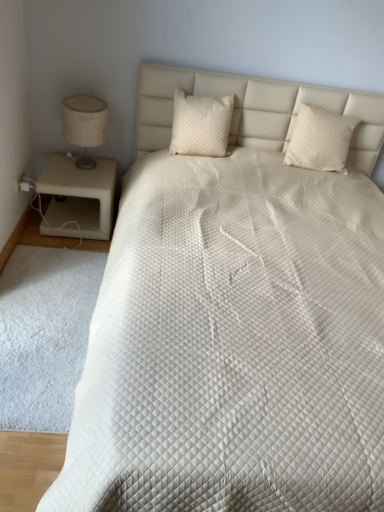
Question: Is white quilted pillow at center, marked as the 2th pillow in a left-to-right arrangement, at the left side of beige matte nightstand at left?

Choices:
 (A) yes
 (B) no

Answer: (B)

Question: Is white quilted pillow at center, which is the first pillow from right to left, aimed at beige matte nightstand at left?

Choices:
 (A) no
 (B) yes

Answer: (A)

Question: Considering the relative sizes of white quilted pillow at center, which is the first pillow from right to left, and beige matte nightstand at left in the image provided, is white quilted pillow at center, which is the first pillow from right to left, shorter than beige matte nightstand at left?

Choices:
 (A) yes
 (B) no

Answer: (A)

Question: Is white quilted pillow at center, marked as the 2th pillow in a left-to-right arrangement, at the right side of beige matte nightstand at left?

Choices:
 (A) no
 (B) yes

Answer: (B)

Question: Are white quilted pillow at center, marked as the 2th pillow in a left-to-right arrangement, and beige matte nightstand at left making contact?

Choices:
 (A) yes
 (B) no

Answer: (B)

Question: From the image's perspective, is white fluffy rug at lower left positioned above or below white quilted pillow at center, marked as the 2th pillow in a right-to-left arrangement?

Choices:
 (A) above
 (B) below

Answer: (B)

Question: Considering the positions of white fluffy rug at lower left and white quilted pillow at center, which is the 1th pillow in left-to-right order, in the image, is white fluffy rug at lower left taller or shorter than white quilted pillow at center, which is the 1th pillow in left-to-right order,?

Choices:
 (A) short
 (B) tall

Answer: (A)

Question: In terms of size, does white fluffy rug at lower left appear bigger or smaller than white quilted pillow at center, marked as the 2th pillow in a right-to-left arrangement?

Choices:
 (A) small
 (B) big

Answer: (A)

Question: From a real-world perspective, is white fluffy rug at lower left above or below white quilted pillow at center, which is the 1th pillow in left-to-right order?

Choices:
 (A) below
 (B) above

Answer: (A)

Question: From the image's perspective, relative to white fluffy rug at lower left, is white quilted pillow at center, marked as the 2th pillow in a left-to-right arrangement, above or below?

Choices:
 (A) below
 (B) above

Answer: (B)

Question: Is point (342, 150) closer or farther from the camera than point (59, 400)?

Choices:
 (A) closer
 (B) farther

Answer: (B)

Question: Is white quilted pillow at center, marked as the 2th pillow in a left-to-right arrangement, in front of or behind white fluffy rug at lower left in the image?

Choices:
 (A) behind
 (B) front

Answer: (A)

Question: In terms of height, does white quilted pillow at center, which is the first pillow from right to left, look taller or shorter compared to white fluffy rug at lower left?

Choices:
 (A) short
 (B) tall

Answer: (B)

Question: Is white quilted pillow at center, marked as the 2th pillow in a right-to-left arrangement, bigger or smaller than beige matte nightstand at left?

Choices:
 (A) big
 (B) small

Answer: (B)

Question: Is point (205, 151) closer or farther from the camera than point (77, 199)?

Choices:
 (A) closer
 (B) farther

Answer: (A)